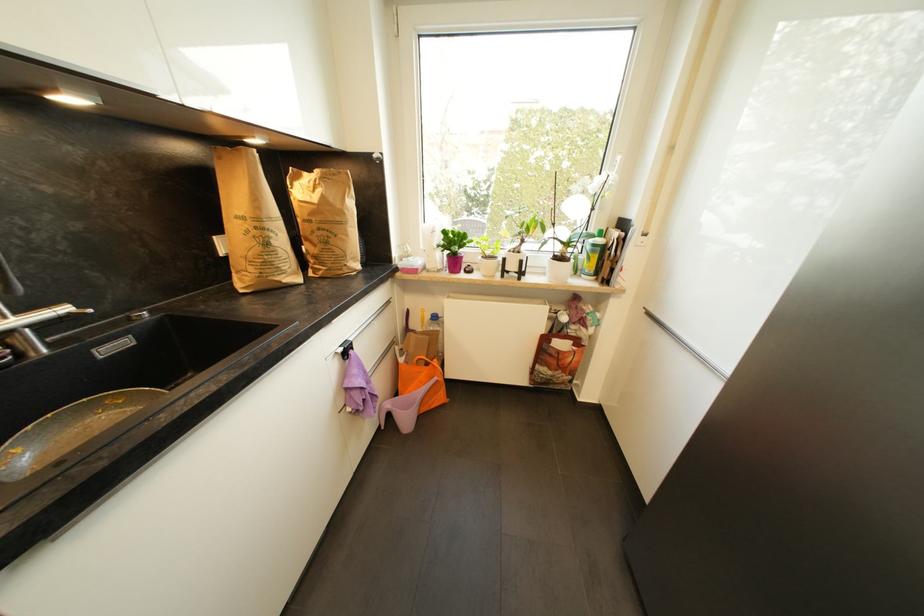
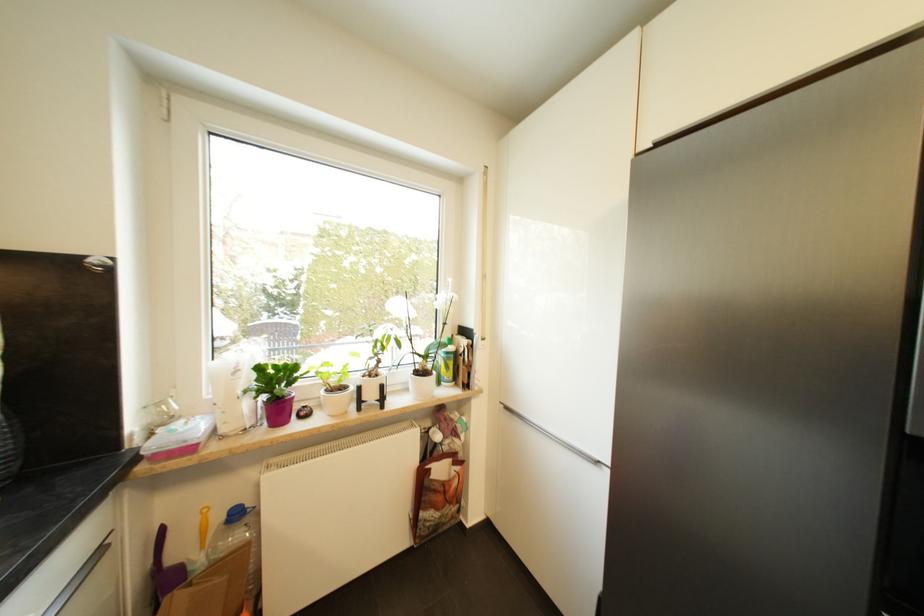
Locate, in the second image, the point that corresponds to pixel 419 273 in the first image.

(195, 451)